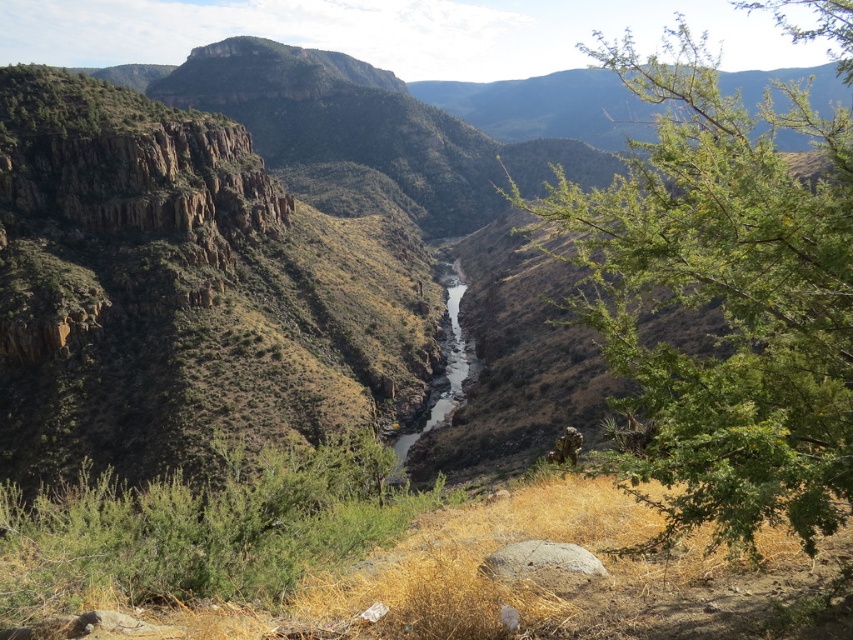
Question: Which of the following is the closest to the observer?

Choices:
 (A) (456, 369)
 (B) (782, 166)

Answer: (B)

Question: Does green leafy tree at lower right come in front of white sandy stream at center?

Choices:
 (A) yes
 (B) no

Answer: (A)

Question: Is green leafy tree at lower right wider than white sandy stream at center?

Choices:
 (A) no
 (B) yes

Answer: (B)

Question: Can you confirm if green leafy tree at lower right is thinner than white sandy stream at center?

Choices:
 (A) yes
 (B) no

Answer: (B)